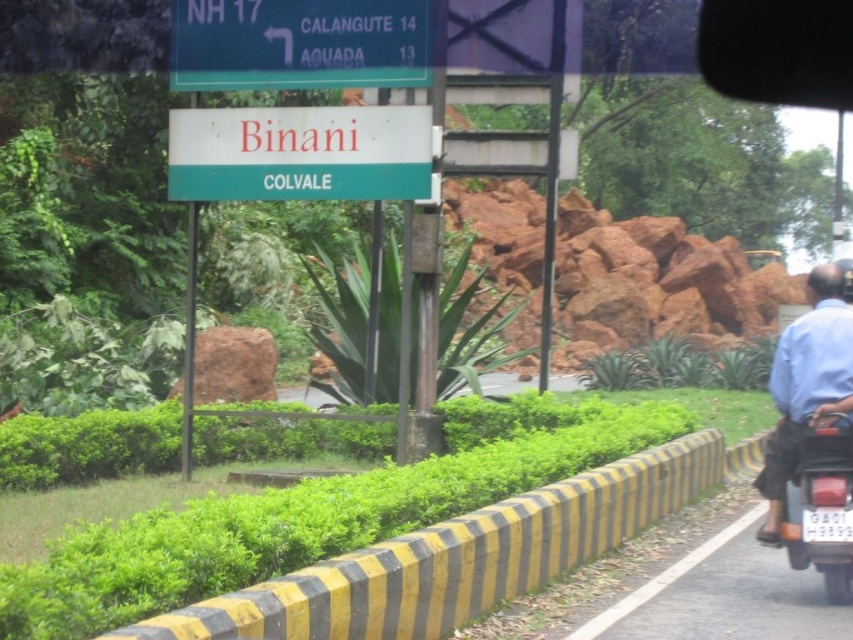
Question: Which point is closer to the camera?

Choices:
 (A) 315,182
 (B) 556,522
 (C) 820,518
 (D) 421,8

Answer: (C)

Question: Which object is positioned farthest from the green matte signboard at upper center?

Choices:
 (A) blue cotton shirt at right
 (B) matte black motorcycle at right

Answer: (B)

Question: Is blue cotton shirt at right further to the viewer compared to matte black motorcycle at right?

Choices:
 (A) yes
 (B) no

Answer: (A)

Question: Can you confirm if white matte sign at center is positioned below matte black motorcycle at right?

Choices:
 (A) yes
 (B) no

Answer: (B)

Question: Is white matte sign at center above green matte signboard at upper center?

Choices:
 (A) no
 (B) yes

Answer: (A)

Question: Which point is farther to the camera?

Choices:
 (A) (247, 42)
 (B) (486, 531)
 (C) (200, 132)

Answer: (C)